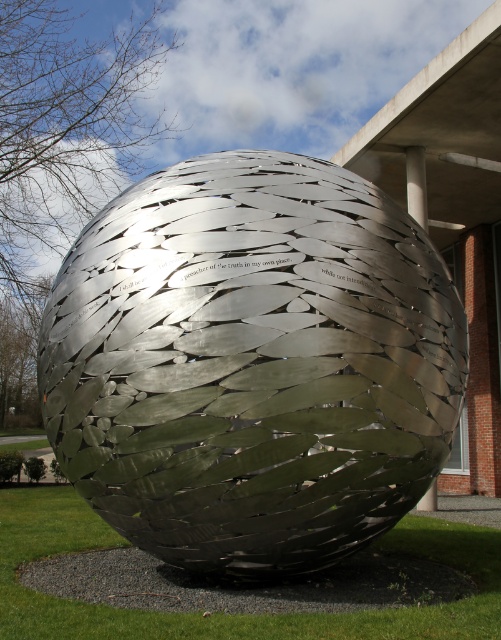
Question: Is metallic silver sphere at center smaller than green grass at center?

Choices:
 (A) no
 (B) yes

Answer: (B)

Question: Which point is closer to the camera taking this photo?

Choices:
 (A) (363, 634)
 (B) (446, 349)

Answer: (A)

Question: Is metallic silver sphere at center in front of green grass at center?

Choices:
 (A) yes
 (B) no

Answer: (B)

Question: Can you confirm if metallic silver sphere at center is positioned to the right of green grass at center?

Choices:
 (A) yes
 (B) no

Answer: (A)

Question: Which of the following is the closest to the observer?

Choices:
 (A) (328, 467)
 (B) (87, 616)

Answer: (B)

Question: Which point is closer to the camera taking this photo?

Choices:
 (A) (123, 230)
 (B) (27, 592)

Answer: (B)